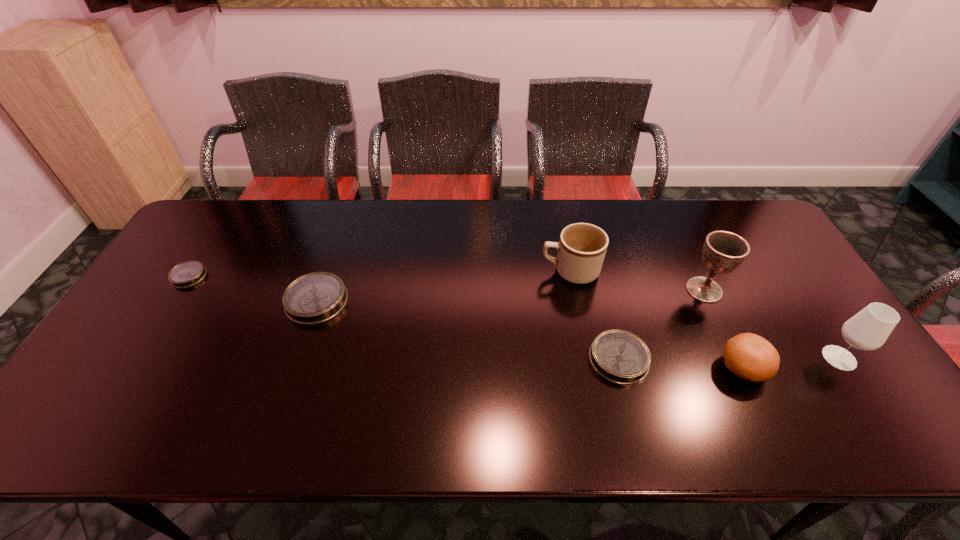
If equal spacing is desired by inserting an extra compass among them, please point out a free spot for this new compass. Please provide its 2D coordinates. Your answer should be formatted as a tuple, i.e. [(x, y)], where the tuple contains the x and y coordinates of a point satisfying the conditions above.

[(459, 328)]